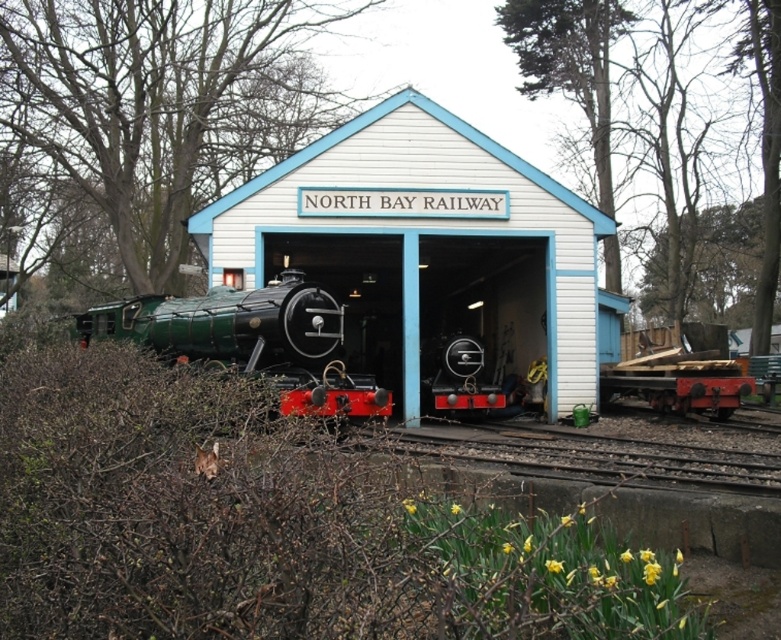
The height and width of the screenshot is (640, 781). What do you see at coordinates (418, 266) in the screenshot?
I see `white wooden railway station at center` at bounding box center [418, 266].

Between white wooden railway station at center and green polished wood train at center, which one appears on the right side from the viewer's perspective?

From the viewer's perspective, white wooden railway station at center appears more on the right side.

Does point (305, 260) lie in front of point (243, 312)?

No, it is behind (243, 312).

Locate an element on the screen. The height and width of the screenshot is (640, 781). white wooden railway station at center is located at coordinates (418, 266).